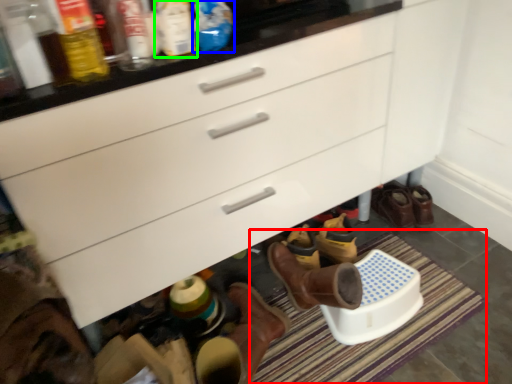
Question: Which is nearer to the bath mat (highlighted by a red box)? bottle (highlighted by a blue box) or bottle (highlighted by a green box).

Choices:
 (A) bottle
 (B) bottle

Answer: (A)